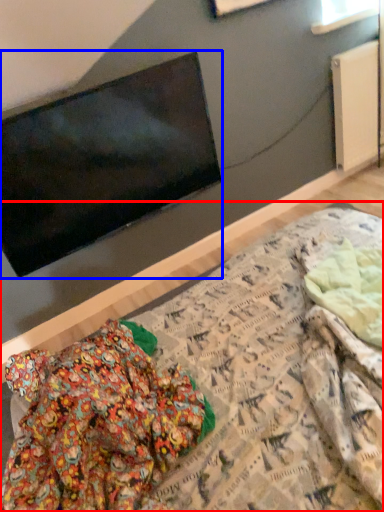
Question: Which object is further to the camera taking this photo, bed (highlighted by a red box) or television (highlighted by a blue box)?

Choices:
 (A) bed
 (B) television

Answer: (B)